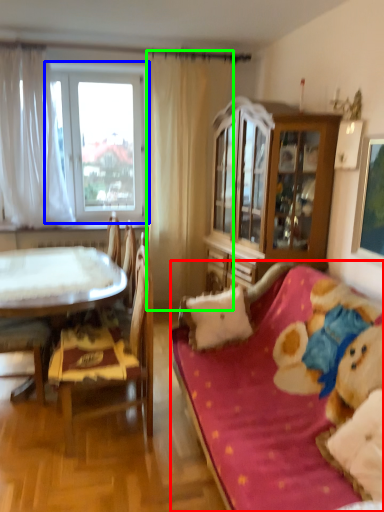
Question: Which object is positioned closest to studio couch (highlighted by a red box)? Select from window (highlighted by a blue box) and curtain (highlighted by a green box).

Choices:
 (A) window
 (B) curtain

Answer: (B)